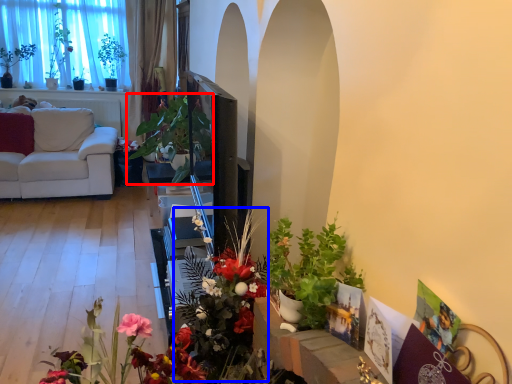
Question: Which point is further to the camera, houseplant (highlighted by a red box) or floral arrangement (highlighted by a blue box)?

Choices:
 (A) houseplant
 (B) floral arrangement

Answer: (A)